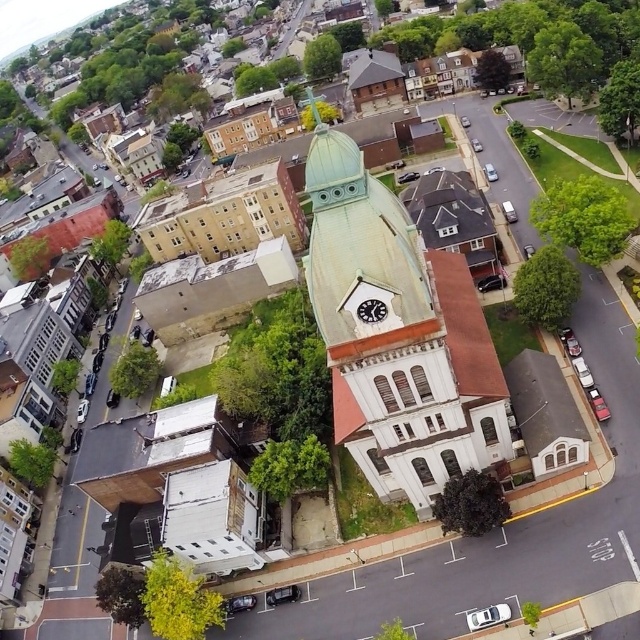
Question: Among these points, which one is farthest from the camera?

Choices:
 (A) (189, 248)
 (B) (392, 440)

Answer: (A)

Question: Considering the relative positions of green copper dome at center and light brown brick building at upper left in the image provided, where is green copper dome at center located with respect to light brown brick building at upper left?

Choices:
 (A) right
 (B) left

Answer: (A)

Question: Which point is closer to the camera?

Choices:
 (A) light brown brick building at upper left
 (B) green copper dome at center

Answer: (B)

Question: Can you confirm if green copper dome at center is wider than light brown brick building at upper left?

Choices:
 (A) no
 (B) yes

Answer: (A)

Question: Does green copper dome at center have a lesser width compared to light brown brick building at upper left?

Choices:
 (A) no
 (B) yes

Answer: (B)